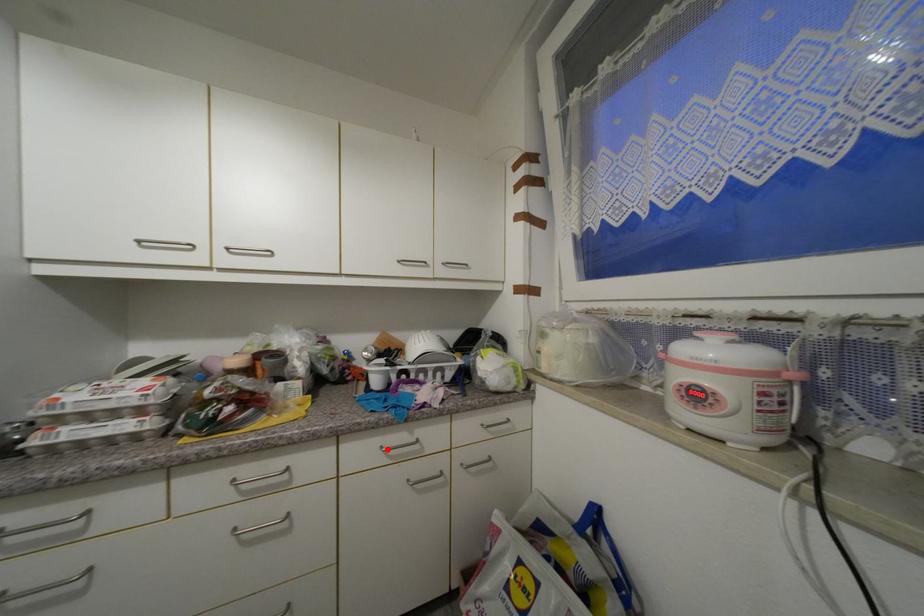
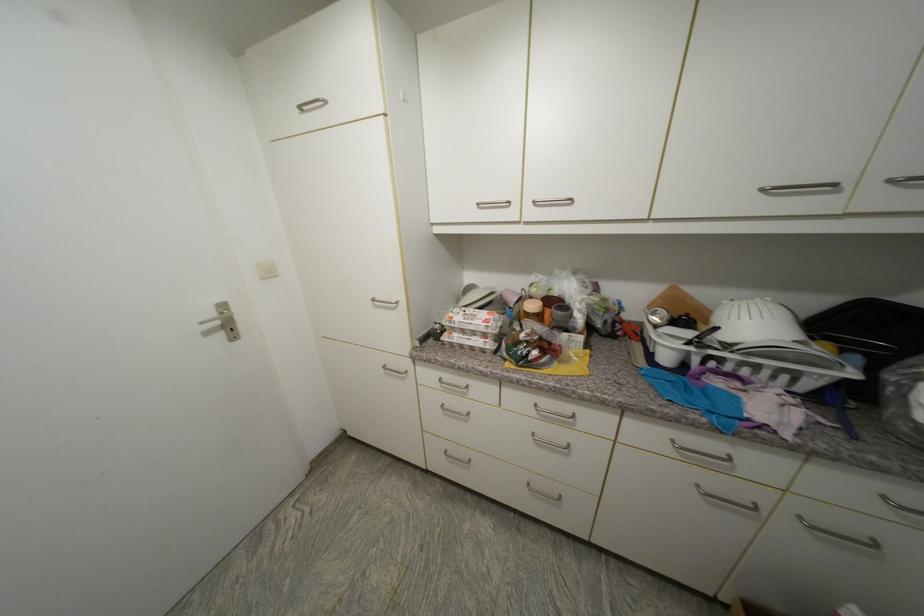
Locate, in the second image, the point that corresponds to the highlighted location in the first image.

(678, 443)